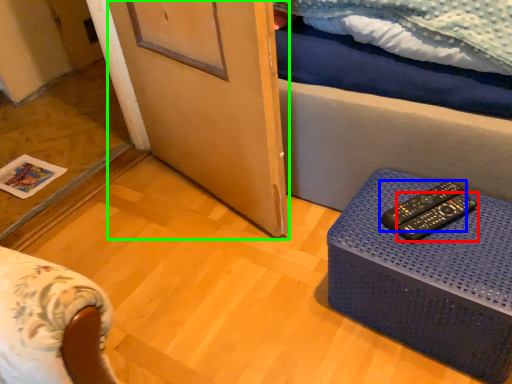
Question: Estimate the real-world distances between objects in this image. Which object is farther from remote control (highlighted by a red box), remote control (highlighted by a blue box) or screen door (highlighted by a green box)?

Choices:
 (A) remote control
 (B) screen door

Answer: (B)